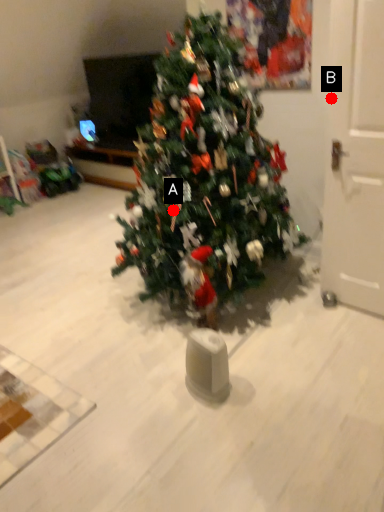
Question: Two points are circled on the image, labeled by A and B beside each circle. Which point is closer to the camera taking this photo?

Choices:
 (A) A is closer
 (B) B is closer

Answer: (A)